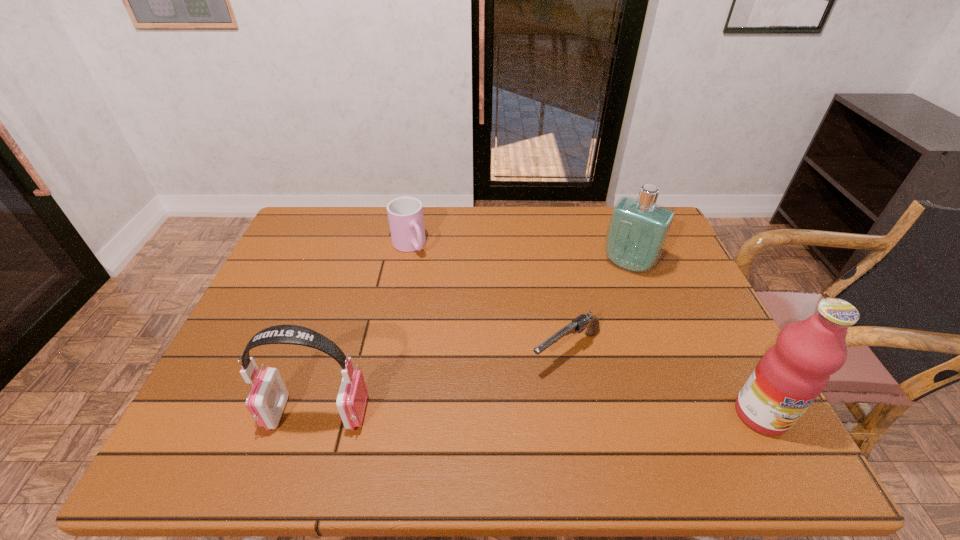
I want to click on perfume present at the far edge, so (638, 229).

This screenshot has height=540, width=960. Identify the location of earphone present at the near edge. (266, 401).

Identify the location of fruit juice that is at the near edge. The height and width of the screenshot is (540, 960). (792, 373).

This screenshot has height=540, width=960. Identify the location of object located at the left edge. (266, 401).

Where is `fruit juice present at the right edge`? This screenshot has height=540, width=960. fruit juice present at the right edge is located at coordinates (792, 373).

You are a GUI agent. You are given a task and a screenshot of the screen. Output one action in this format:
    pyautogui.click(x=<x>, y=<y>)
    Task: Click on the perfume that is at the right edge
    
    Given the screenshot: What is the action you would take?
    pyautogui.click(x=638, y=229)

The image size is (960, 540). In order to click on object located at the near left corner in this screenshot , I will do `click(266, 401)`.

This screenshot has width=960, height=540. Identify the location of object located in the far right corner section of the desktop. (638, 229).

Where is `object present at the near right corner`? object present at the near right corner is located at coordinates (792, 373).

In order to click on free space at the far edge of the desktop in this screenshot , I will do `click(518, 220)`.